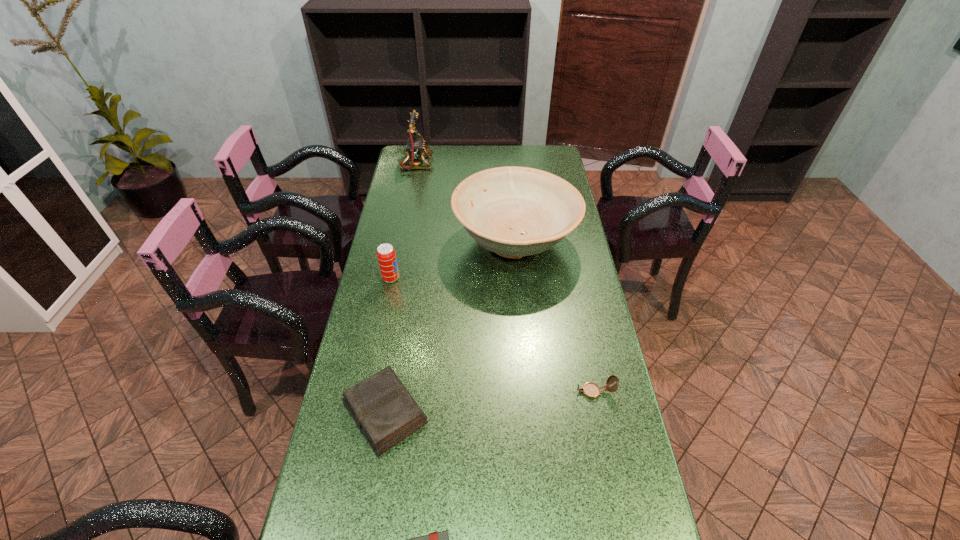
Find the location of a particular element. This screenshot has height=540, width=960. the farthest object is located at coordinates (415, 147).

At what (x,y) coordinates should I click in order to perform the action: click on dish. Please return your answer as a coordinate pair (x, y). The height and width of the screenshot is (540, 960). Looking at the image, I should click on (512, 211).

At what (x,y) coordinates should I click in order to perform the action: click on the fourth shortest object. Please return your answer as a coordinate pair (x, y). Looking at the image, I should click on (386, 255).

Locate an element on the screen. compass is located at coordinates click(591, 390).

You are a GUI agent. You are given a task and a screenshot of the screen. Output one action in this format:
    pyautogui.click(x=<x>, y=<y>)
    Task: Click on the taller book
    The width and height of the screenshot is (960, 540).
    Given the screenshot: What is the action you would take?
    pyautogui.click(x=385, y=412)

At what (x,y) coordinates should I click in order to perform the action: click on the farther book. Please return your answer as a coordinate pair (x, y). This screenshot has width=960, height=540. Looking at the image, I should click on (385, 412).

Find the location of a particular element. The width and height of the screenshot is (960, 540). vacant region located 0.310m on the front of the telephone, featuring the rotary dial is located at coordinates (501, 164).

Find the location of a particular element. Image resolution: width=960 pixels, height=540 pixels. vacant area located 0.130m on the front of the dish is located at coordinates (521, 317).

Locate an element on the screen. The image size is (960, 540). vacant region located 0.170m on the front of the soda can is located at coordinates (381, 325).

Where is `vacant position located 0.320m on the face of the compass`? vacant position located 0.320m on the face of the compass is located at coordinates (454, 392).